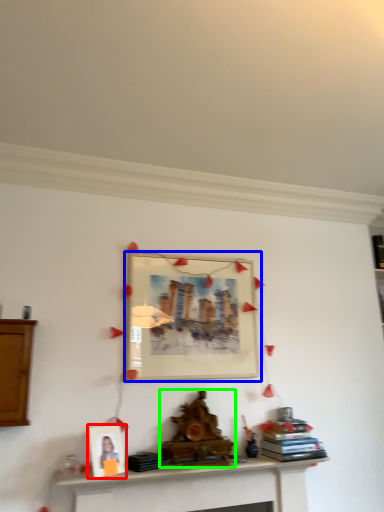
Question: Which object is positioned farthest from picture frame (highlighted by a red box)? Select from picture frame (highlighted by a blue box) and fireplace (highlighted by a green box).

Choices:
 (A) picture frame
 (B) fireplace

Answer: (A)